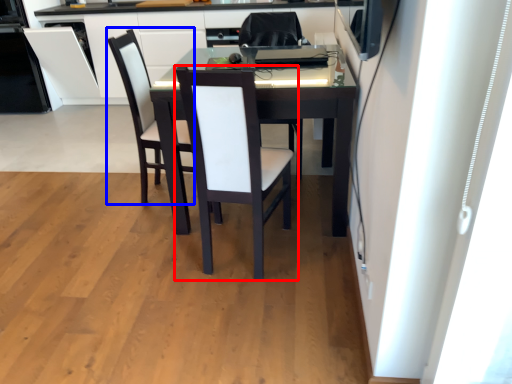
Question: Which object is closer to the camera taking this photo, chair (highlighted by a red box) or armchair (highlighted by a blue box)?

Choices:
 (A) chair
 (B) armchair

Answer: (A)